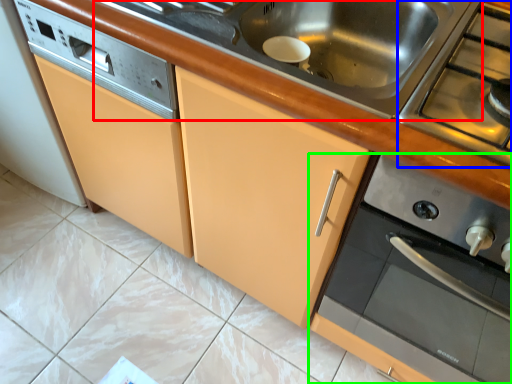
Question: Which object is positioned closest to sink (highlighted by a red box)? Select from gas stove (highlighted by a blue box) and home appliance (highlighted by a green box).

Choices:
 (A) gas stove
 (B) home appliance

Answer: (A)